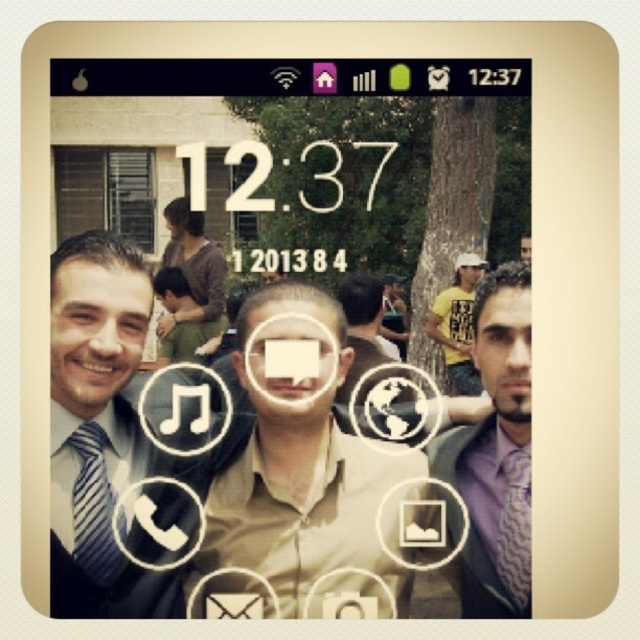
Question: Which object is positioned closest to the matte beige shirt at center?

Choices:
 (A) purple silk shirt at right
 (B) white matte face at center
 (C) smooth skin face at right

Answer: (B)

Question: Is matte black face at left to the left of yellow casual shirt at upper right from the viewer's perspective?

Choices:
 (A) no
 (B) yes

Answer: (B)

Question: Does striped tie at left appear on the left side of smooth skin face at right?

Choices:
 (A) no
 (B) yes

Answer: (B)

Question: Can you confirm if purple silk shirt at right is smaller than green fabric shirt at center?

Choices:
 (A) no
 (B) yes

Answer: (A)

Question: Which point appears closest to the camera in this image?

Choices:
 (A) (500, 298)
 (B) (108, 518)

Answer: (A)

Question: Which object appears farthest from the camera in this image?

Choices:
 (A) matte beige shirt at center
 (B) matte black face at left
 (C) smooth skin face at center
 (D) purple silk shirt at right

Answer: (C)